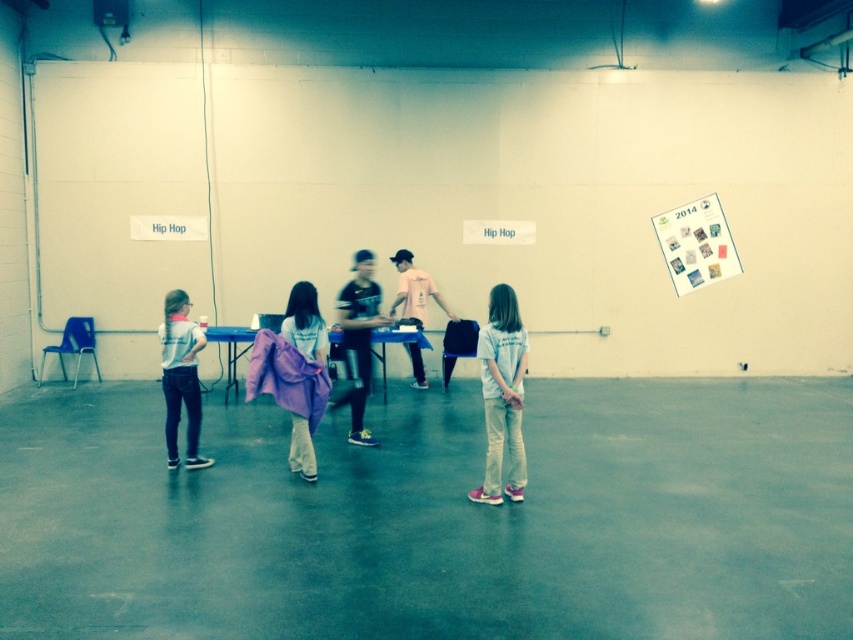
Question: Which of the following is the closest to the observer?

Choices:
 (A) (165, 442)
 (B) (358, 432)
 (C) (303, 474)

Answer: (C)

Question: Based on their relative distances, which object is farther from the light gray fabric shirt at left?

Choices:
 (A) white cotton shirt at center
 (B) purple fabric at center
 (C) black matte shirt at center
 (D) pink cotton shirt at center

Answer: (D)

Question: Observing the image, what is the correct spatial positioning of black matte shirt at center in reference to purple fabric at center?

Choices:
 (A) right
 (B) left

Answer: (A)

Question: In this image, where is light gray fabric shirt at left located relative to black matte shirt at center?

Choices:
 (A) above
 (B) below

Answer: (B)

Question: Does white cotton shirt at center appear under pink cotton shirt at center?

Choices:
 (A) yes
 (B) no

Answer: (A)

Question: Which point is closer to the camera taking this photo?

Choices:
 (A) (368, 364)
 (B) (189, 410)
 (C) (413, 308)
 (D) (297, 410)

Answer: (D)